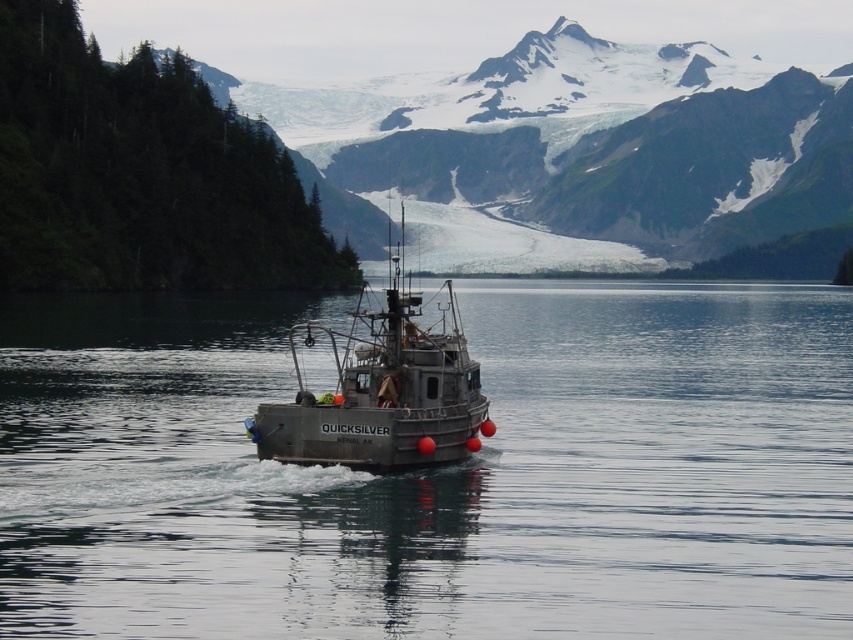
Consider the image. Is clear water at center below snowy granite mountain at upper center?

Indeed, clear water at center is positioned under snowy granite mountain at upper center.

From the picture: Who is more forward, (698, 632) or (576, 204)?

Point (698, 632)

Describe the element at coordinates (436, 472) in the screenshot. I see `clear water at center` at that location.

I want to click on clear water at center, so click(436, 472).

Who is lower down, clear water at center or gray metallic fishing boat at center?

Positioned lower is clear water at center.

Between clear water at center and gray metallic fishing boat at center, which one has more height?

gray metallic fishing boat at center is taller.

Find the location of a particular element. clear water at center is located at coordinates (436, 472).

Can you confirm if snowy granite mountain at upper center is positioned to the right of gray metallic fishing boat at center?

Correct, you'll find snowy granite mountain at upper center to the right of gray metallic fishing boat at center.

Measure the distance between point (419, 88) and camera.

Point (419, 88) is 2057.96 feet from camera.

Locate an element on the screen. snowy granite mountain at upper center is located at coordinates (572, 150).

Locate an element on the screen. The height and width of the screenshot is (640, 853). snowy granite mountain at upper center is located at coordinates (572, 150).